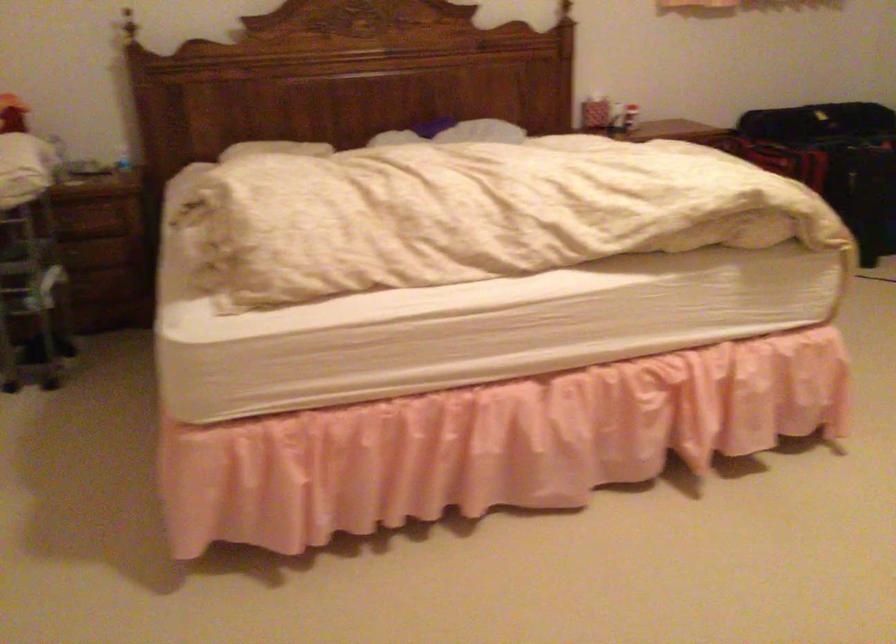
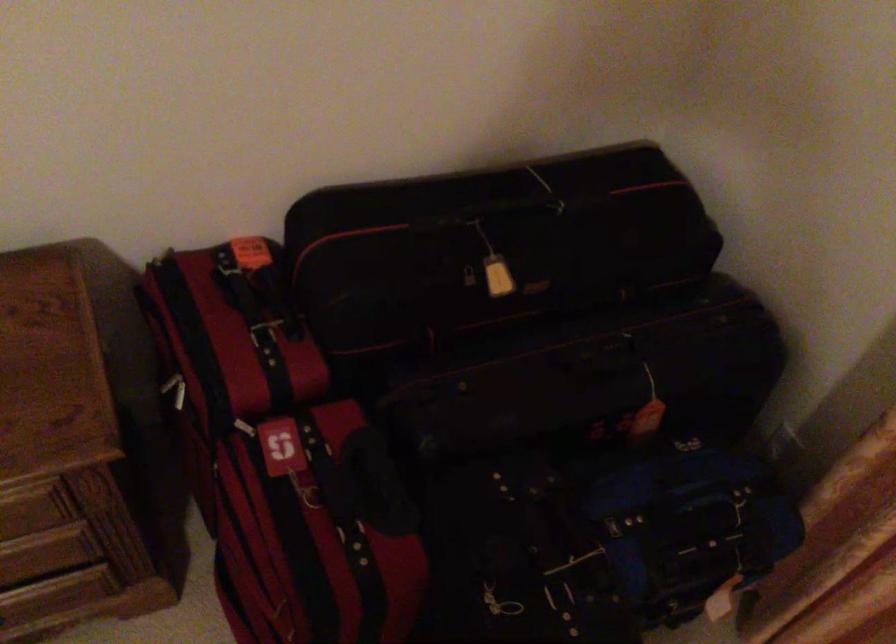
Locate, in the second image, the point that corresponds to (x=748, y=109) in the first image.

(264, 334)